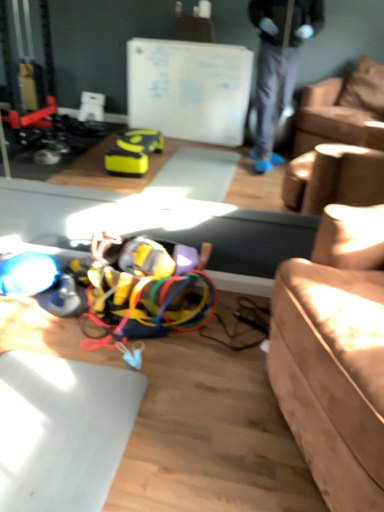
Question: From a real-world perspective, is multicolored plastic wires at center beneath leather couch at right?

Choices:
 (A) yes
 (B) no

Answer: (A)

Question: Is multicolored plastic wires at center to the right of leather couch at right from the viewer's perspective?

Choices:
 (A) yes
 (B) no

Answer: (B)

Question: From a real-world perspective, is multicolored plastic wires at center on top of leather couch at right?

Choices:
 (A) yes
 (B) no

Answer: (B)

Question: From the image's perspective, would you say multicolored plastic wires at center is positioned over leather couch at right?

Choices:
 (A) yes
 (B) no

Answer: (A)

Question: Is multicolored plastic wires at center thinner than leather couch at right?

Choices:
 (A) no
 (B) yes

Answer: (B)

Question: Is multicolored plastic wires at center completely or partially outside of leather couch at right?

Choices:
 (A) no
 (B) yes

Answer: (B)

Question: Is leather couch at right bigger than multicolored plastic wires at center?

Choices:
 (A) no
 (B) yes

Answer: (B)

Question: Can you confirm if leather couch at right is wider than multicolored plastic wires at center?

Choices:
 (A) no
 (B) yes

Answer: (B)

Question: Is leather couch at right thinner than multicolored plastic wires at center?

Choices:
 (A) no
 (B) yes

Answer: (A)

Question: Can you confirm if leather couch at right is taller than multicolored plastic wires at center?

Choices:
 (A) no
 (B) yes

Answer: (B)

Question: Is leather couch at right turned away from multicolored plastic wires at center?

Choices:
 (A) no
 (B) yes

Answer: (A)

Question: From a real-world perspective, is leather couch at right on top of multicolored plastic wires at center?

Choices:
 (A) no
 (B) yes

Answer: (B)

Question: Looking at their shapes, would you say multicolored plastic wires at center is wider or thinner than leather couch at right?

Choices:
 (A) thin
 (B) wide

Answer: (A)